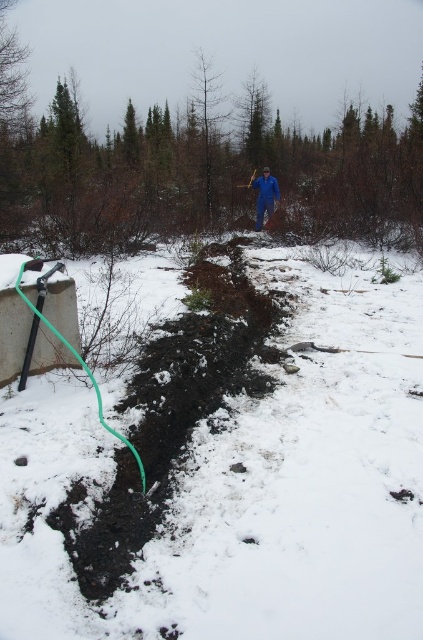
Between black soil at center and green rubber garden hose at lower left, which one appears on the left side from the viewer's perspective?

From the viewer's perspective, green rubber garden hose at lower left appears more on the left side.

Who is shorter, black soil at center or green rubber garden hose at lower left?

With less height is black soil at center.

Is point (365, 259) farther from camera compared to point (33, 310)?

Yes, it is.

Find the location of `black soil at center`. black soil at center is located at coordinates (236, 492).

Does green rubber garden hose at lower left appear under blue fabric person at center?

Yes, green rubber garden hose at lower left is below blue fabric person at center.

Is green rubber garden hose at lower left shorter than blue fabric person at center?

Indeed, green rubber garden hose at lower left has a lesser height compared to blue fabric person at center.

Does point (27, 264) lie in front of point (268, 182)?

Yes, point (27, 264) is closer to viewer.

The height and width of the screenshot is (640, 423). Identify the location of green rubber garden hose at lower left. (77, 362).

Does black soil at center have a smaller size compared to blue fabric person at center?

No, black soil at center is not smaller than blue fabric person at center.

Which is above, black soil at center or blue fabric person at center?

blue fabric person at center is above.

At what (x,y) coordinates should I click in order to perform the action: click on black soil at center. Please return your answer as a coordinate pair (x, y). The image size is (423, 640). Looking at the image, I should click on (236, 492).

Locate an element on the screen. This screenshot has width=423, height=640. black soil at center is located at coordinates (236, 492).